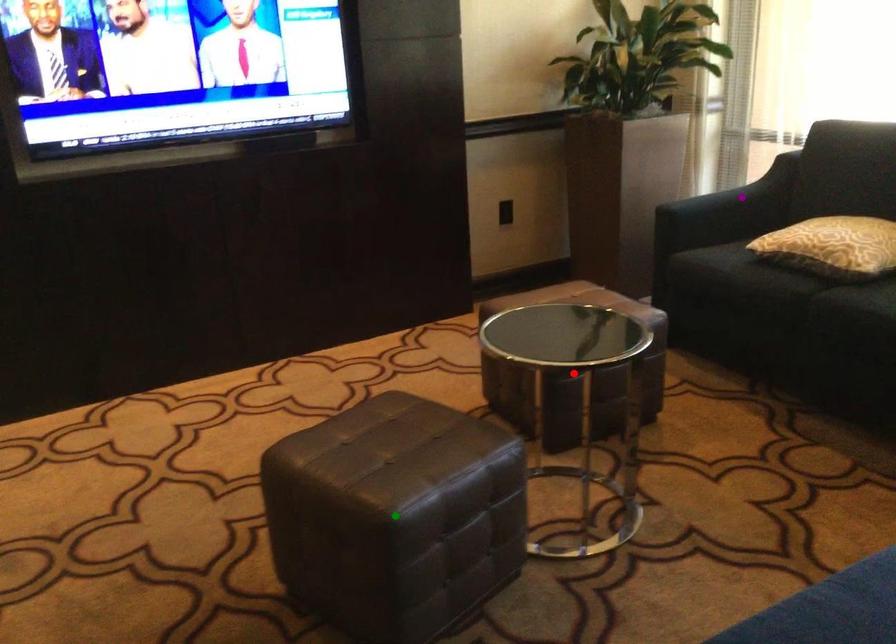
Order these from nearest to farthest:
green point | purple point | red point

green point < red point < purple point